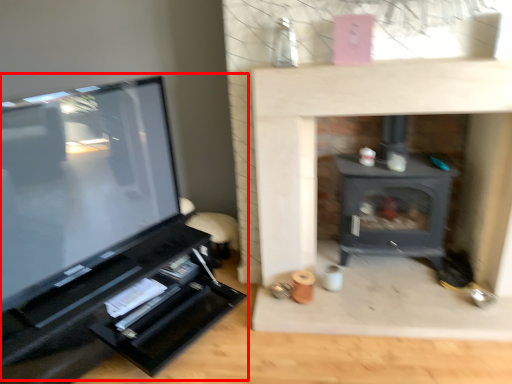
Question: From the image's perspective, what is the correct spatial relationship of entertainment center (annotated by the red box) in relation to wood burning stove?

Choices:
 (A) above
 (B) below

Answer: (B)